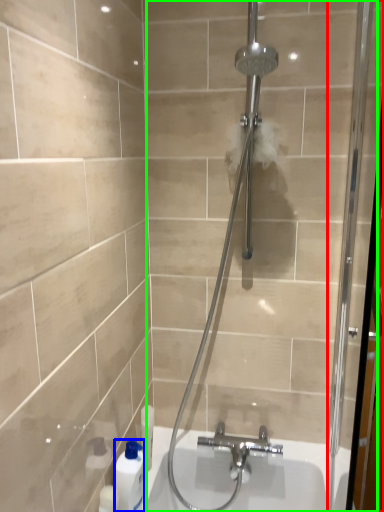
Question: Considering the real-world distances, which object is closest to screen door (highlighted by a red box)? cleaning product (highlighted by a blue box) or shower door (highlighted by a green box).

Choices:
 (A) cleaning product
 (B) shower door

Answer: (B)